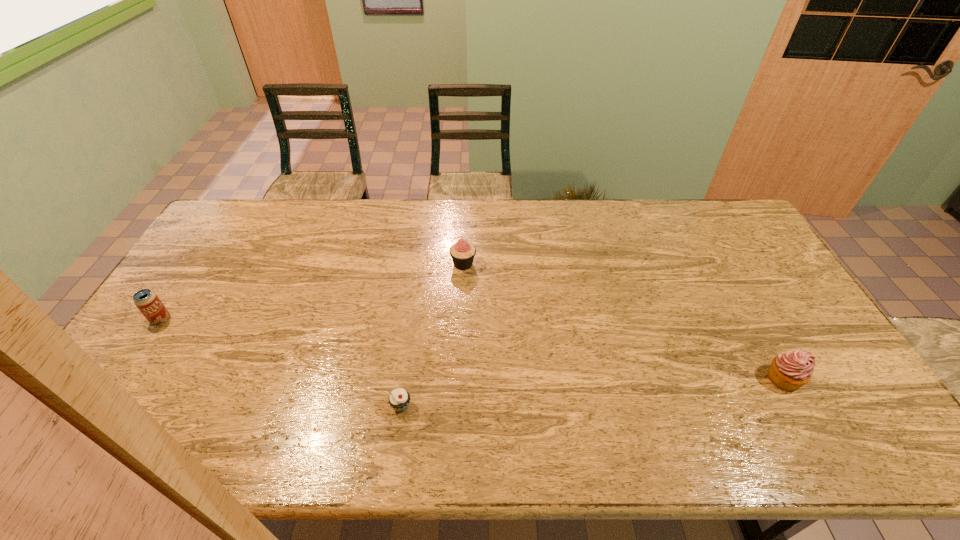
I want to click on free point located on the front of the leftmost object, so click(127, 371).

Image resolution: width=960 pixels, height=540 pixels. I want to click on vacant region located 0.060m on the back of the shortest cupcake, so click(x=405, y=376).

Find the location of a particular element. The image size is (960, 540). object that is at the left edge is located at coordinates (147, 301).

Where is `object present at the right edge`? object present at the right edge is located at coordinates (789, 371).

The image size is (960, 540). I want to click on free space at the far edge, so click(410, 198).

The image size is (960, 540). Find the location of `free space at the near edge of the desktop`. free space at the near edge of the desktop is located at coordinates (503, 440).

Locate an element on the screen. vacant point at the left edge is located at coordinates (144, 389).

Where is `free space at the right edge of the desktop`? free space at the right edge of the desktop is located at coordinates (758, 253).

This screenshot has height=540, width=960. In the image, there is a desktop. Identify the location of vacant area at the far left corner. (243, 234).

This screenshot has width=960, height=540. Identify the location of blank space at the near left corner of the desktop. (132, 450).